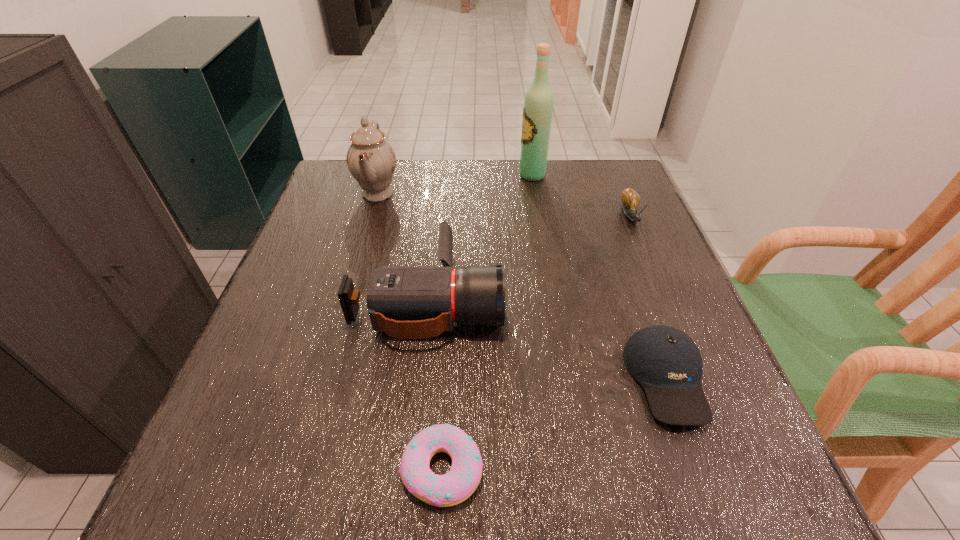
Identify the location of vacant space located 0.100m on the spout of the chinaware. (439, 193).

The height and width of the screenshot is (540, 960). In order to click on vacant space located on the lens of the camcorder in this screenshot , I will do `click(611, 300)`.

The height and width of the screenshot is (540, 960). In order to click on free space located on the front-facing side of the baseball cap in this screenshot , I will do `click(713, 509)`.

Where is `vacant region located on the front-facing side of the escargot`? Image resolution: width=960 pixels, height=540 pixels. vacant region located on the front-facing side of the escargot is located at coordinates (668, 307).

Where is `free spot located 0.100m on the left of the doughnut`? The width and height of the screenshot is (960, 540). free spot located 0.100m on the left of the doughnut is located at coordinates (333, 469).

This screenshot has width=960, height=540. I want to click on wine bottle located at the far edge, so point(538,105).

At what (x,y) coordinates should I click in order to perform the action: click on chinaware that is at the far edge. Please return your answer as a coordinate pair (x, y). The width and height of the screenshot is (960, 540). Looking at the image, I should click on (371, 160).

Find the location of a particular element. escargot present at the far edge is located at coordinates (630, 198).

You are a GUI agent. You are given a task and a screenshot of the screen. Output one action in this format:
    pyautogui.click(x=<x>, y=<y>)
    Task: Click on the object at the near edge
    
    Given the screenshot: What is the action you would take?
    pyautogui.click(x=454, y=487)

The height and width of the screenshot is (540, 960). Identify the location of object present at the left edge. (371, 160).